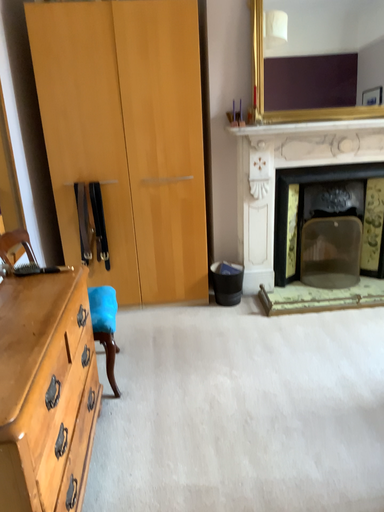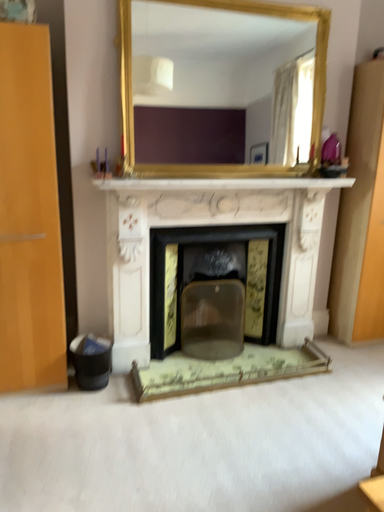
Question: Which way did the camera rotate in the video?

Choices:
 (A) rotated right
 (B) rotated left

Answer: (A)